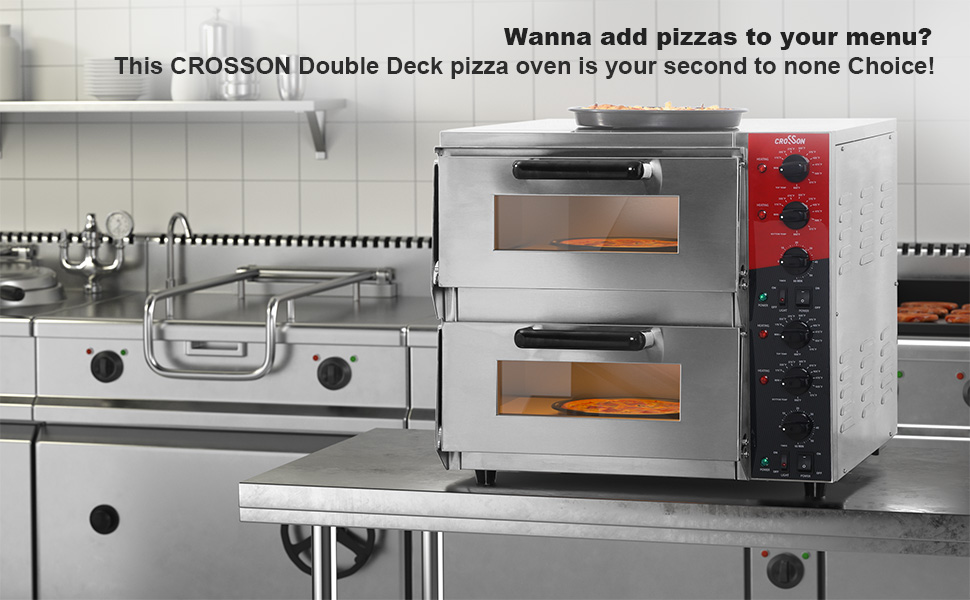
Where is `switch`? switch is located at coordinates (799, 469), (795, 305).